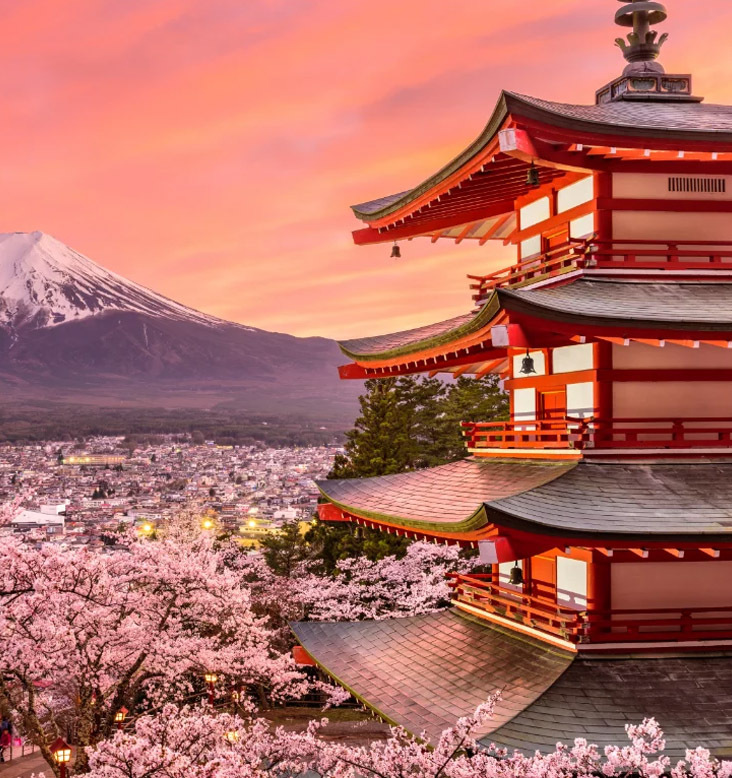
At what (x,y) coordinates should I click in order to perform the action: click on lights. Please return your answer as a coordinate pair (x, y). Looking at the image, I should click on (85, 458), (64, 750), (143, 527), (206, 523), (253, 527).